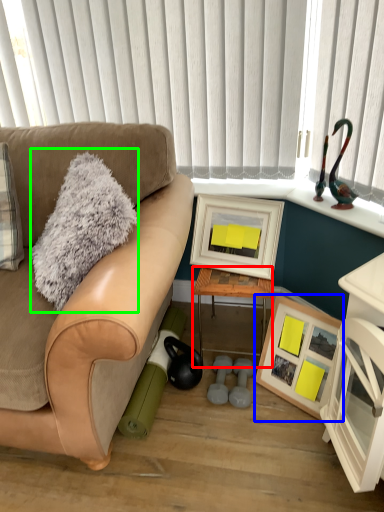
Question: Which object is positioned farthest from table (highlighted by a red box)? Select from picture frame (highlighted by a blue box) and throw pillow (highlighted by a green box).

Choices:
 (A) picture frame
 (B) throw pillow

Answer: (B)